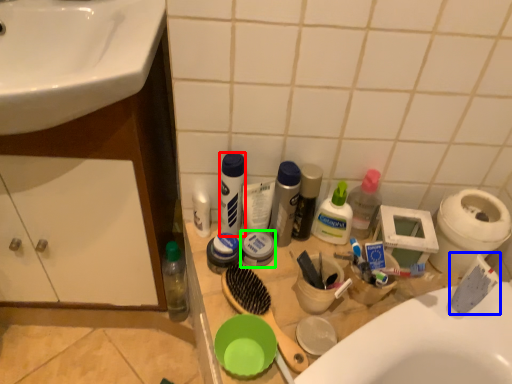
Question: Which object is positioned closest to toiletry (highlighted by a red box)? Select from toothpaste (highlighted by a blue box) and toiletry (highlighted by a green box).

Choices:
 (A) toothpaste
 (B) toiletry

Answer: (B)